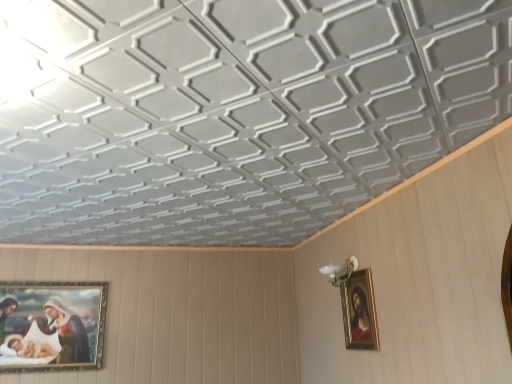
Question: In terms of height, does gold-framed painting at lower left, placed as the 1th picture frame when sorted from left to right, look taller or shorter compared to gold-framed painting at upper right, placed as the first picture frame when sorted from front to back?

Choices:
 (A) short
 (B) tall

Answer: (B)

Question: Do you think gold-framed painting at lower left, the second picture frame from the right, is within gold-framed painting at upper right, which is the second picture frame from back to front, or outside of it?

Choices:
 (A) outside
 (B) inside

Answer: (A)

Question: In terms of size, does gold-framed painting at lower left, placed as the 1th picture frame when sorted from left to right, appear bigger or smaller than gold-framed painting at upper right, which is the second picture frame from back to front?

Choices:
 (A) small
 (B) big

Answer: (B)

Question: Considering the positions of gold-framed painting at upper right, placed as the first picture frame when sorted from front to back, and gold-framed painting at lower left, the second picture frame from the right, in the image, is gold-framed painting at upper right, placed as the first picture frame when sorted from front to back, bigger or smaller than gold-framed painting at lower left, the second picture frame from the right,?

Choices:
 (A) big
 (B) small

Answer: (B)

Question: From the image's perspective, is gold-framed painting at upper right, placed as the first picture frame when sorted from front to back, above or below gold-framed painting at lower left, the second picture frame positioned from the front?

Choices:
 (A) below
 (B) above

Answer: (B)

Question: Considering the positions of point (361, 296) and point (46, 327), is point (361, 296) closer or farther from the camera than point (46, 327)?

Choices:
 (A) closer
 (B) farther

Answer: (A)

Question: Is gold-framed painting at upper right, which appears as the second picture frame when viewed from the left, in front of or behind gold-framed painting at lower left, the second picture frame positioned from the front, in the image?

Choices:
 (A) front
 (B) behind

Answer: (A)